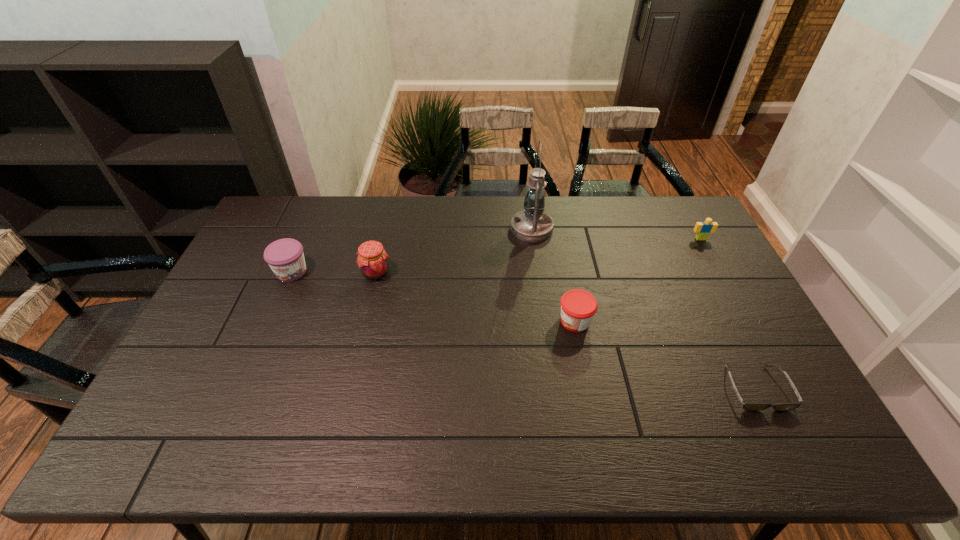
Find the location of a particular element. This screenshot has height=540, width=960. free location located on the front label of the leftmost jam is located at coordinates (279, 299).

I want to click on free spot located 0.170m on the face of the Lego, so click(720, 275).

Find the location of `vacant position located 0.330m on the label side of the fifth farthest object`. vacant position located 0.330m on the label side of the fifth farthest object is located at coordinates (444, 321).

This screenshot has width=960, height=540. Find the location of `free space located on the label side of the fifth farthest object`. free space located on the label side of the fifth farthest object is located at coordinates point(441,321).

Where is `free region located 0.130m on the label side of the fifth farthest object`? The width and height of the screenshot is (960, 540). free region located 0.130m on the label side of the fifth farthest object is located at coordinates (513, 321).

The image size is (960, 540). What are the coordinates of `object that is positioned at the far edge` in the screenshot? It's located at (532, 224).

Locate an element on the screen. Image resolution: width=960 pixels, height=540 pixels. object at the left edge is located at coordinates (285, 257).

I want to click on Lego located in the right edge section of the desktop, so click(702, 229).

At what (x,y) coordinates should I click in order to perform the action: click on sunglasses positioned at the right edge. Please return your answer as a coordinate pair (x, y). Image resolution: width=960 pixels, height=540 pixels. Looking at the image, I should click on (746, 406).

In the image, there is a desktop. Where is `blank space at the far edge`? This screenshot has height=540, width=960. blank space at the far edge is located at coordinates (372, 212).